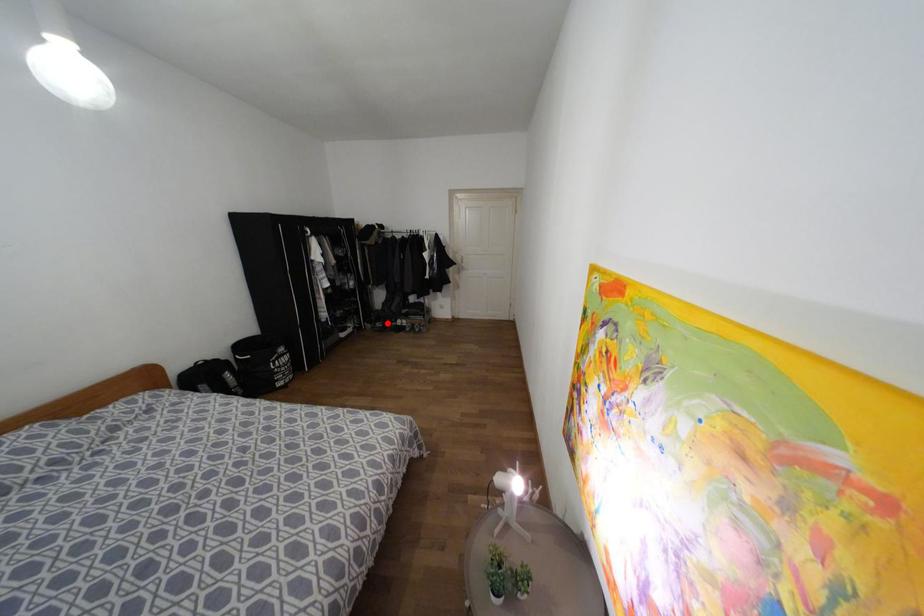
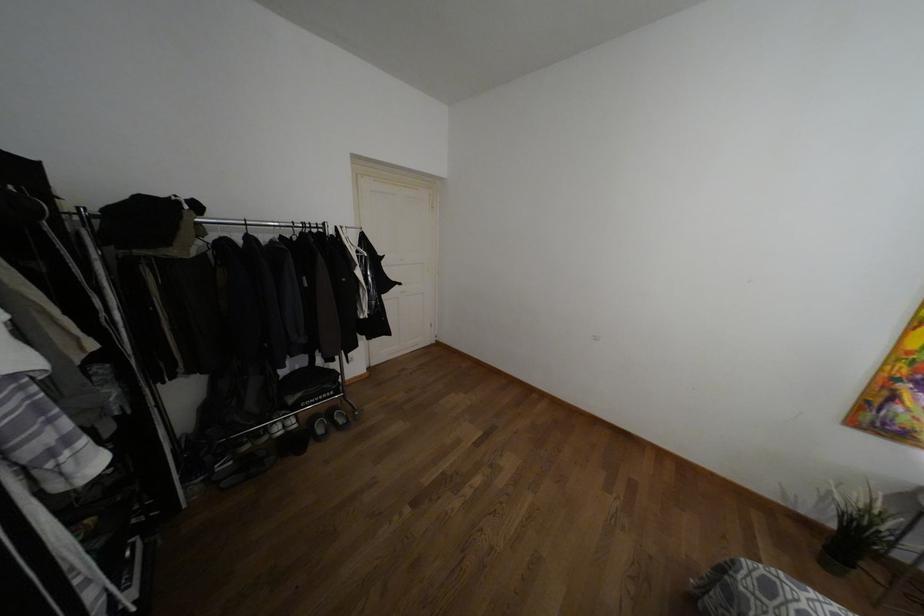
In the second image, find the point that corresponds to the highlighted location in the first image.

(246, 447)